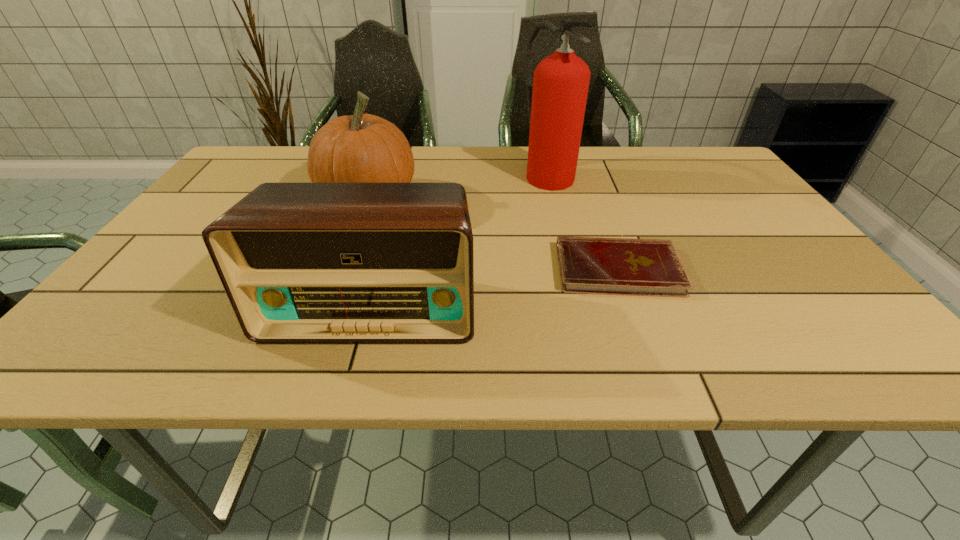
The width and height of the screenshot is (960, 540). I want to click on fire extinguisher, so click(556, 105).

Identify the location of pumpkin. click(x=362, y=148).

Where is `radio receiver`? The height and width of the screenshot is (540, 960). radio receiver is located at coordinates (300, 262).

Image resolution: width=960 pixels, height=540 pixels. I want to click on the shortest object, so click(x=588, y=265).

Locate an element on the screen. The width and height of the screenshot is (960, 540). free region located 0.320m on the handle side of the tallest object is located at coordinates pos(571,271).

Locate an element on the screen. vacant space located on the stem of the pumpkin is located at coordinates (513, 200).

Find the location of a particular element. vacant region located 0.290m on the right of the shortest object is located at coordinates (814, 269).

Identify the location of fire extinguisher at the far edge. (556, 105).

Locate an element on the screen. pumpkin located at the far edge is located at coordinates (362, 148).

Locate an element on the screen. object positioned at the near edge is located at coordinates (300, 262).